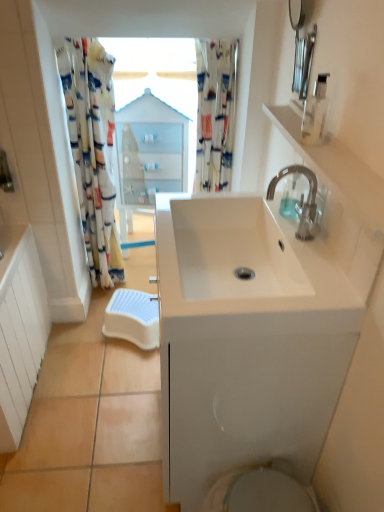
Question: Is white plastic step stool at lower center taller than white glossy cabinet at center?

Choices:
 (A) yes
 (B) no

Answer: (B)

Question: Is white plastic step stool at lower center positioned behind white glossy cabinet at center?

Choices:
 (A) no
 (B) yes

Answer: (A)

Question: Is white plastic step stool at lower center facing towards white glossy cabinet at center?

Choices:
 (A) no
 (B) yes

Answer: (A)

Question: Considering the relative sizes of white plastic step stool at lower center and white glossy cabinet at center in the image provided, is white plastic step stool at lower center bigger than white glossy cabinet at center?

Choices:
 (A) yes
 (B) no

Answer: (B)

Question: Considering the relative sizes of white plastic step stool at lower center and white glossy cabinet at center in the image provided, is white plastic step stool at lower center thinner than white glossy cabinet at center?

Choices:
 (A) no
 (B) yes

Answer: (B)

Question: Considering the positions of point (213, 138) and point (168, 112), is point (213, 138) closer or farther from the camera than point (168, 112)?

Choices:
 (A) farther
 (B) closer

Answer: (B)

Question: Is printed fabric shower curtain at upper center, acting as the 2th shower curtain starting from the left, inside or outside of white glossy cabinet at center?

Choices:
 (A) inside
 (B) outside

Answer: (B)

Question: From a real-world perspective, is printed fabric shower curtain at upper center, acting as the 2th shower curtain starting from the left, physically located above or below white glossy cabinet at center?

Choices:
 (A) above
 (B) below

Answer: (A)

Question: From the image's perspective, is printed fabric shower curtain at upper center, which ranks as the 1th shower curtain in right-to-left order, positioned above or below white glossy cabinet at center?

Choices:
 (A) below
 (B) above

Answer: (B)

Question: Considering the positions of white glossy cabinet at center and white glossy sink at center in the image, is white glossy cabinet at center bigger or smaller than white glossy sink at center?

Choices:
 (A) small
 (B) big

Answer: (B)

Question: Do you think white glossy cabinet at center is within white glossy sink at center, or outside of it?

Choices:
 (A) inside
 (B) outside

Answer: (B)

Question: Considering the positions of point (170, 137) and point (193, 301), is point (170, 137) closer or farther from the camera than point (193, 301)?

Choices:
 (A) closer
 (B) farther

Answer: (B)

Question: Is white glossy cabinet at center wider or thinner than white glossy sink at center?

Choices:
 (A) thin
 (B) wide

Answer: (A)

Question: Does point (314, 181) appear closer or farther from the camera than point (321, 132)?

Choices:
 (A) farther
 (B) closer

Answer: (A)

Question: In the image, is silver metallic faucet at upper right positioned in front of or behind transparent plastic soap dispenser at upper right, arranged as the 2th soap dispenser when ordered from the bottom?

Choices:
 (A) front
 (B) behind

Answer: (B)